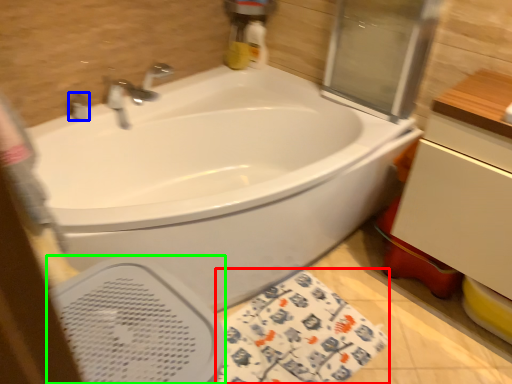
Question: Estimate the real-world distances between objects in this image. Which object is farther from beach towel (highlighted by a red box), plumbing fixture (highlighted by a blue box) or bidet (highlighted by a green box)?

Choices:
 (A) plumbing fixture
 (B) bidet

Answer: (A)